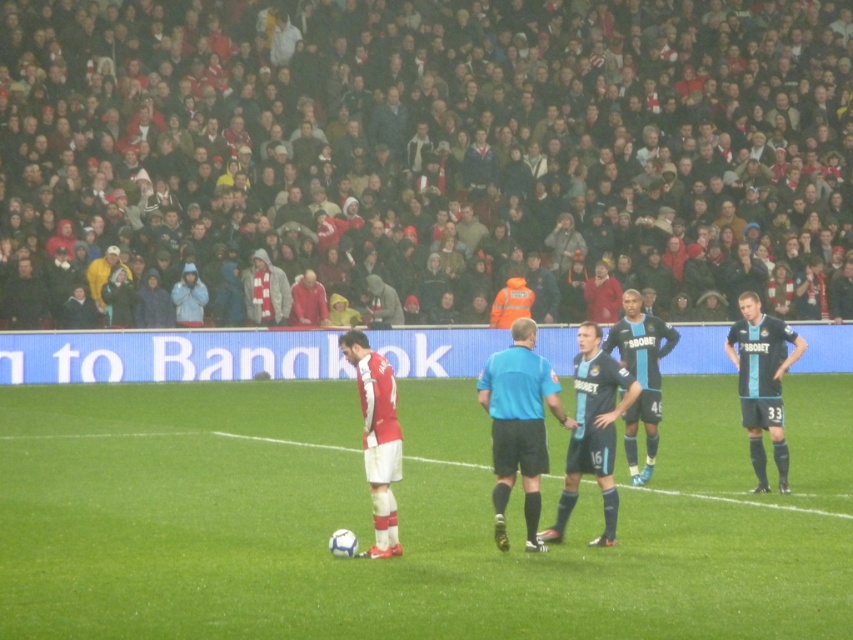
Is green grass football field at center taller than dark blue jersey at center?

Incorrect, green grass football field at center's height is not larger of dark blue jersey at center's.

Does green grass football field at center appear under dark blue jersey at center?

Yes.

Does point (514, 515) come closer to viewer compared to point (753, 371)?

Yes, it is.

At what (x,y) coordinates should I click in order to perform the action: click on green grass football field at center. Please return your answer as a coordinate pair (x, y). Looking at the image, I should click on (401, 520).

Is green grass football field at center closer to the viewer compared to white matte football at center?

Yes, green grass football field at center is closer to the viewer.

Can you confirm if green grass football field at center is thinner than white matte football at center?

No.

Who is more forward, (628,512) or (364,476)?

Point (628,512)

I want to click on green grass football field at center, so click(401, 520).

This screenshot has width=853, height=640. What are the coordinates of `dark blue jersey at center` in the screenshot? It's located at [x=762, y=381].

Measure the distance between point (770, 317) and camera.

The distance of point (770, 317) from camera is 49.29 feet.

You are a GUI agent. You are given a task and a screenshot of the screen. Output one action in this format:
    pyautogui.click(x=<x>, y=<y>)
    Task: Click on the dark blue jersey at center
    This screenshot has height=640, width=853.
    Given the screenshot: What is the action you would take?
    pyautogui.click(x=762, y=381)